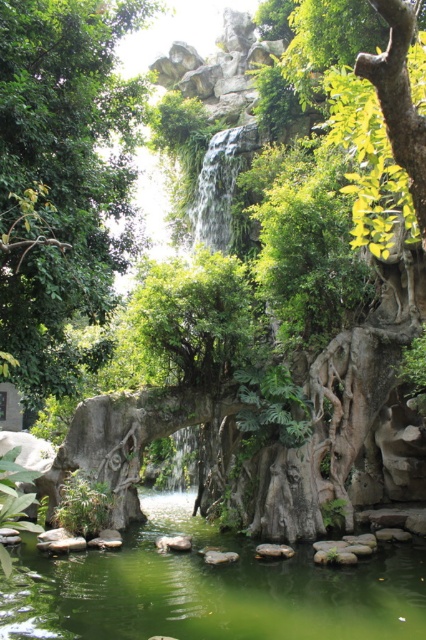
Does green liquid water at center appear over clear water at center?

No, green liquid water at center is not above clear water at center.

Is point (396, 566) more distant than point (209, 225)?

No.

Who is more forward, (36,616) or (230,216)?

Point (36,616) is in front.

Identify the location of green liquid water at center. This screenshot has height=640, width=426. (210, 589).

Is green leafy tree at center smaller than green liquid water at center?

Incorrect, green leafy tree at center is not smaller in size than green liquid water at center.

What do you see at coordinates (62, 177) in the screenshot? I see `green leafy tree at center` at bounding box center [62, 177].

Identify the location of green leafy tree at center. (62, 177).

Can you confirm if green leafy tree at center is positioned to the right of clear water at center?

No, green leafy tree at center is not to the right of clear water at center.

Does green leafy tree at center have a smaller size compared to clear water at center?

Incorrect, green leafy tree at center is not smaller in size than clear water at center.

Is point (43, 84) farther from viewer compared to point (215, 225)?

No, (43, 84) is in front of (215, 225).

Image resolution: width=426 pixels, height=640 pixels. Find the location of `green leafy tree at center`. green leafy tree at center is located at coordinates (62, 177).